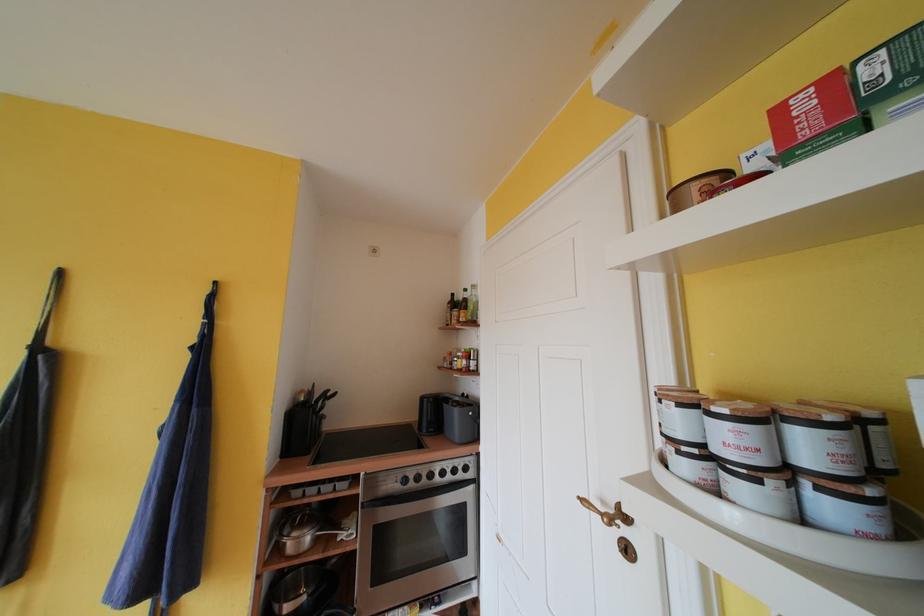
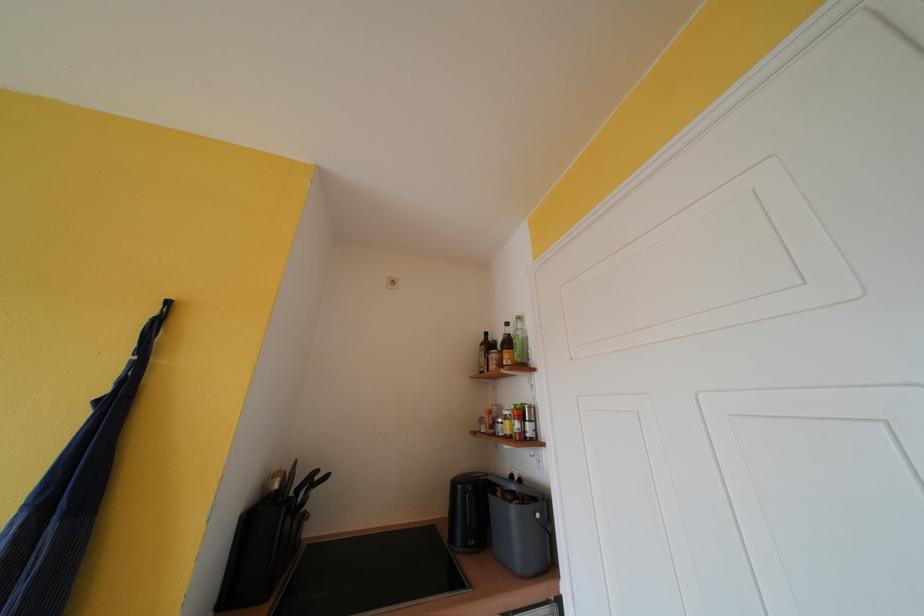
Which direction would the cameraman need to move to produce the second image?

The cameraman moved toward left, forward.